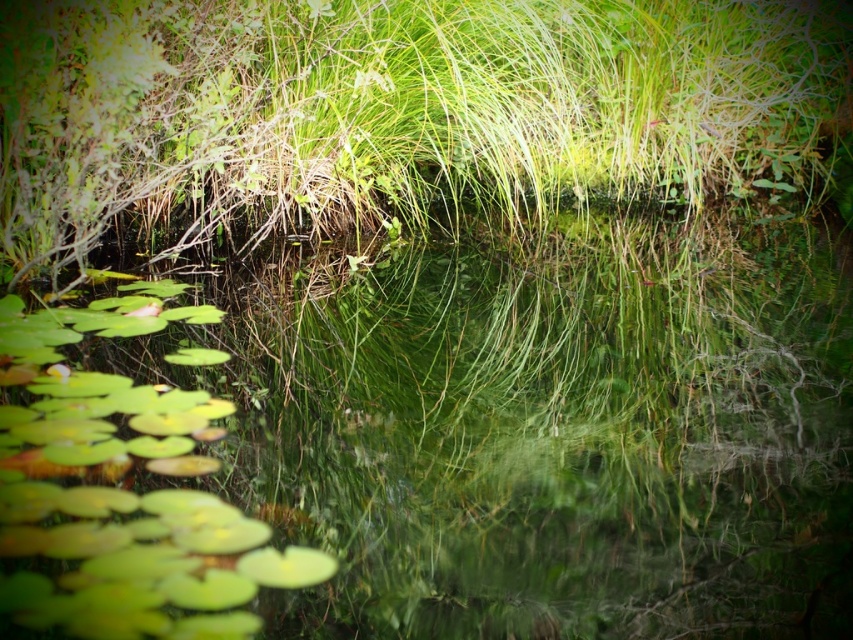
You are standing at the edge of the pond and see two points in the water. The first point is at coordinates point (410,88) and the second is at point (219,620). Which point is closer to you?

Point (219,620) is closer to you because it is in front of point (410,88).

You are standing at the edge of the pond and want to see the green glossy lily pads at lower left. Are they partially hidden by the green grass at center?

Yes, the green glossy lily pads at lower left are partially hidden because they are positioned behind the green grass at center.